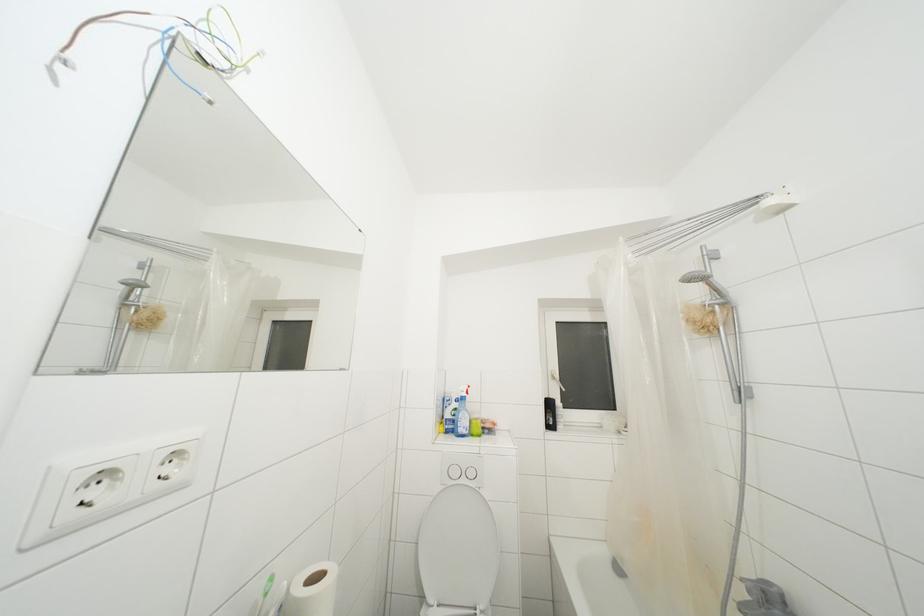
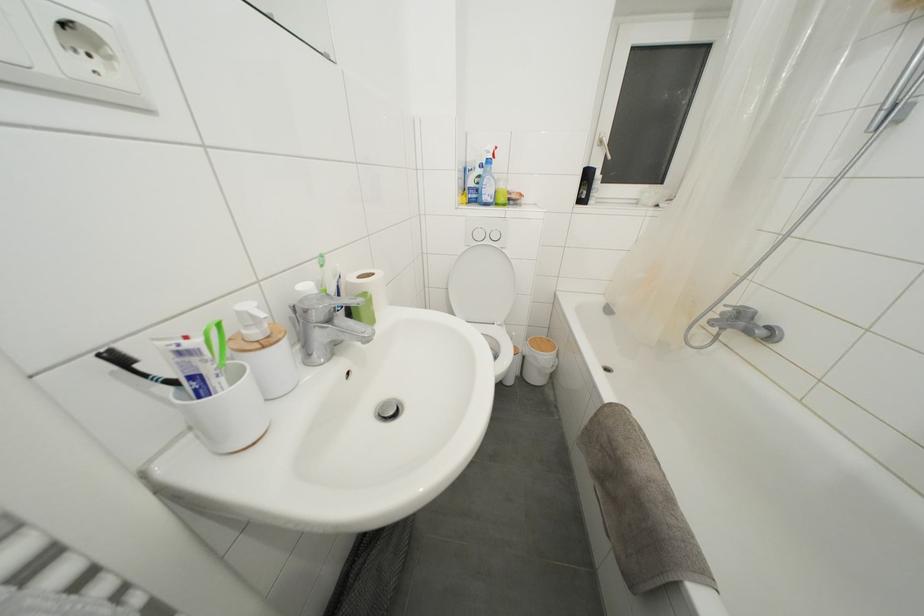
The point at (481,496) is marked in the first image. Where is the corresponding point in the second image?

(505, 256)